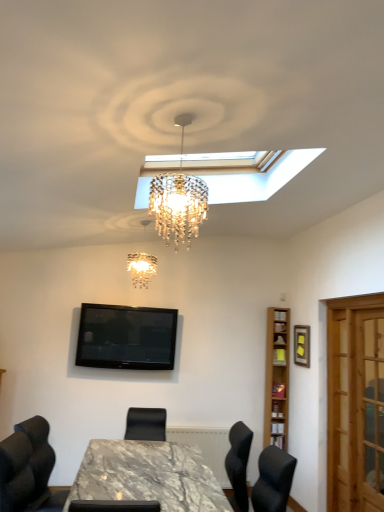
Question: Is wooden picture frame at upper right shorter than light brown wooden bookshelf at right?

Choices:
 (A) yes
 (B) no

Answer: (A)

Question: Considering the relative sizes of wooden picture frame at upper right and light brown wooden bookshelf at right in the image provided, is wooden picture frame at upper right bigger than light brown wooden bookshelf at right?

Choices:
 (A) yes
 (B) no

Answer: (B)

Question: Is wooden picture frame at upper right not within light brown wooden bookshelf at right?

Choices:
 (A) no
 (B) yes

Answer: (B)

Question: Would you say light brown wooden bookshelf at right is part of wooden picture frame at upper right's contents?

Choices:
 (A) no
 (B) yes

Answer: (A)

Question: From a real-world perspective, is wooden picture frame at upper right positioned under light brown wooden bookshelf at right based on gravity?

Choices:
 (A) yes
 (B) no

Answer: (B)

Question: Considering the relative positions of black glossy tv at upper center and wooden screen door at right in the image provided, is black glossy tv at upper center to the left or to the right of wooden screen door at right?

Choices:
 (A) left
 (B) right

Answer: (A)

Question: Relative to wooden screen door at right, is black glossy tv at upper center in front or behind?

Choices:
 (A) behind
 (B) front

Answer: (A)

Question: In terms of height, does black glossy tv at upper center look taller or shorter compared to wooden screen door at right?

Choices:
 (A) tall
 (B) short

Answer: (B)

Question: Do you think black glossy tv at upper center is within wooden screen door at right, or outside of it?

Choices:
 (A) inside
 (B) outside

Answer: (B)

Question: Do you think crystal chandelier at center is within wooden screen door at right, or outside of it?

Choices:
 (A) outside
 (B) inside

Answer: (A)

Question: Considering the positions of crystal chandelier at center and wooden screen door at right in the image, is crystal chandelier at center wider or thinner than wooden screen door at right?

Choices:
 (A) wide
 (B) thin

Answer: (A)

Question: Is crystal chandelier at center bigger or smaller than wooden screen door at right?

Choices:
 (A) small
 (B) big

Answer: (A)

Question: From a real-world perspective, is crystal chandelier at center above or below wooden screen door at right?

Choices:
 (A) above
 (B) below

Answer: (A)

Question: Is wooden picture frame at upper right in front of or behind crystal chandelier at center in the image?

Choices:
 (A) behind
 (B) front

Answer: (A)

Question: From a real-world perspective, is wooden picture frame at upper right physically located above or below crystal chandelier at center?

Choices:
 (A) below
 (B) above

Answer: (A)